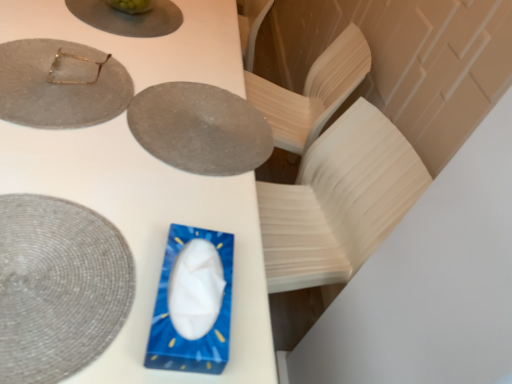
Where is `free space behind matte gray placemat at lower left, arranged as the 4th plate when viewed from the top`? Image resolution: width=512 pixels, height=384 pixels. free space behind matte gray placemat at lower left, arranged as the 4th plate when viewed from the top is located at coordinates (128, 168).